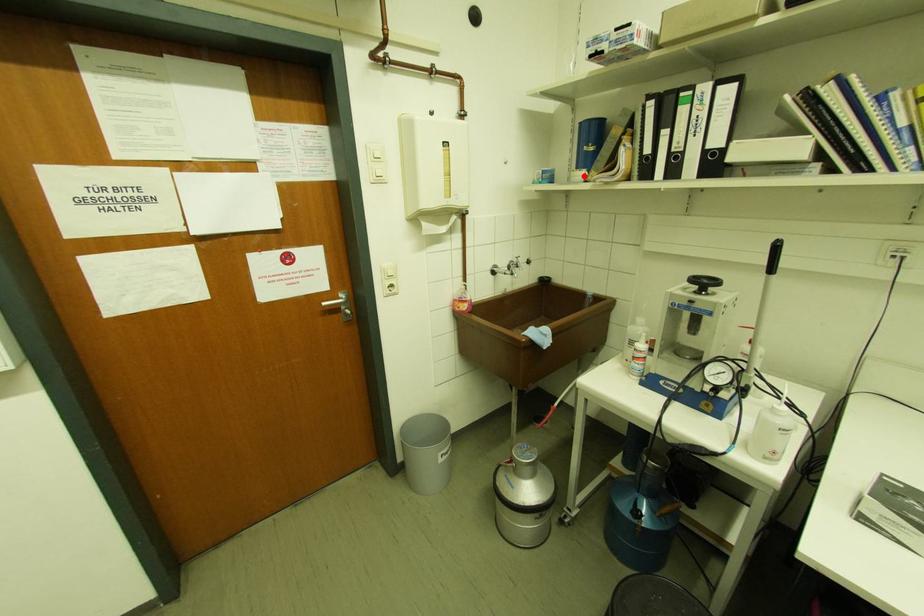
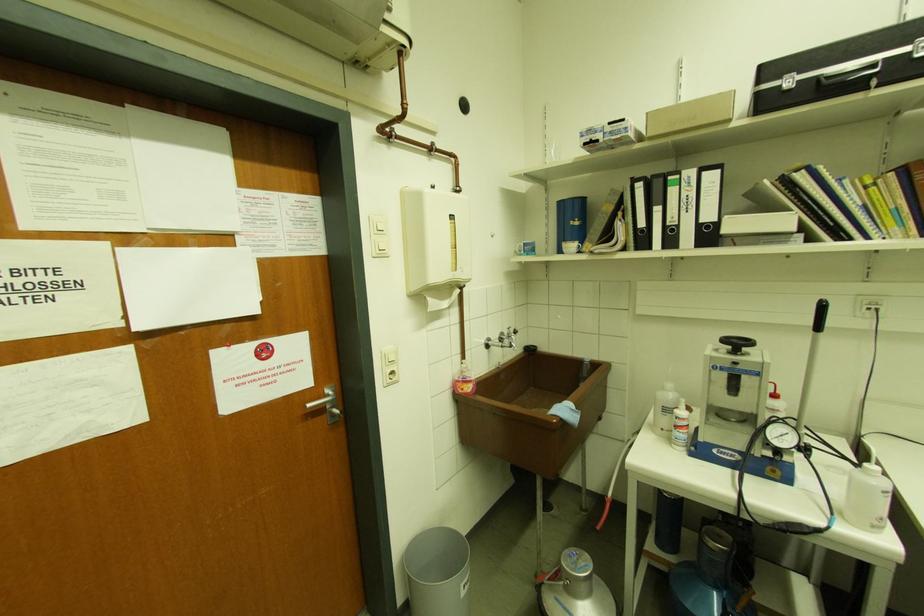
Find the pixel in the second image that matches the highlighted location in the first image.

(575, 246)